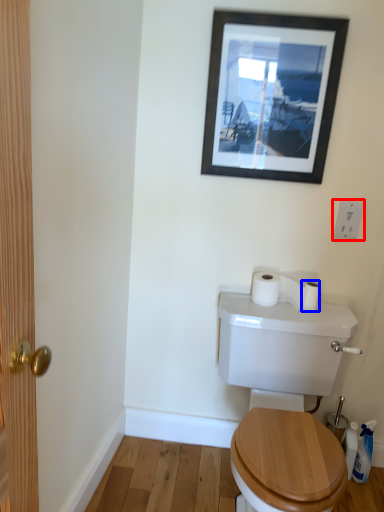
Question: Which object is closer to the camera taking this photo, electric outlet (highlighted by a red box) or toilet paper (highlighted by a blue box)?

Choices:
 (A) electric outlet
 (B) toilet paper

Answer: (A)